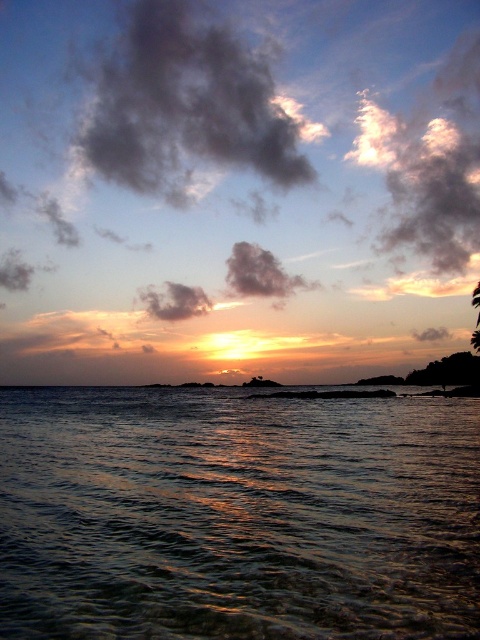
From the picture: Is dark gray cloud at upper center thinner than fuzzy white cloud at upper right?

In fact, dark gray cloud at upper center might be wider than fuzzy white cloud at upper right.

Measure the distance between dark gray cloud at upper center and camera.

dark gray cloud at upper center and camera are 766.35 feet apart from each other.

Where is `dark gray cloud at upper center`? Image resolution: width=480 pixels, height=640 pixels. dark gray cloud at upper center is located at coordinates (186, 106).

Consider the image. Between shiny reflective water at center and fuzzy white cloud at upper right, which one has less height?

With less height is shiny reflective water at center.

Is point (36, 554) positioned before point (398, 122)?

Yes, it is in front of point (398, 122).

This screenshot has width=480, height=640. I want to click on shiny reflective water at center, so click(x=237, y=516).

Between shiny reflective water at center and dark gray cloud at upper center, which one has more height?

dark gray cloud at upper center is taller.

Who is lower down, shiny reflective water at center or dark gray cloud at upper center?

Positioned lower is shiny reflective water at center.

Between point (98, 522) and point (136, 49), which one is positioned behind?

Positioned behind is point (136, 49).

Identify the location of shiny reflective water at center. (237, 516).